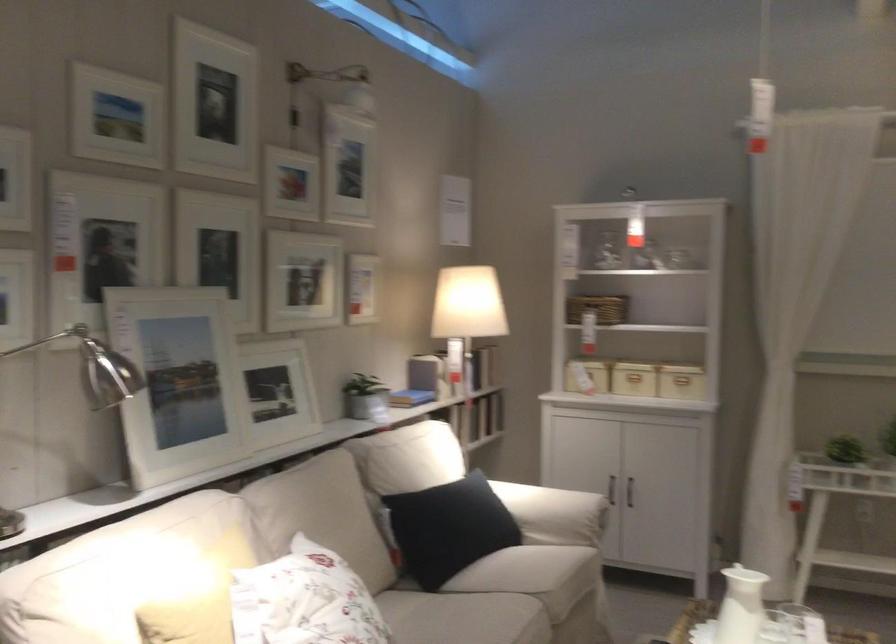
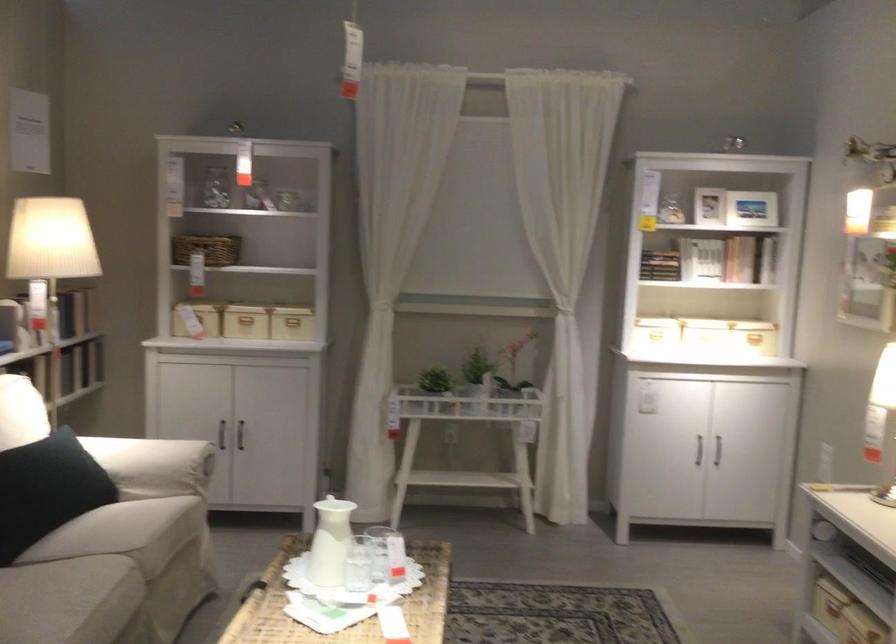
Where in the second image is the point corresponding to the point at 634,486 from the first image?

(240, 435)